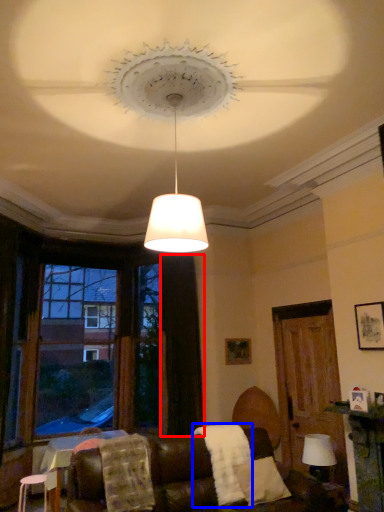
Question: Which of the following is the farthest to the observer, curtain (highlighted by a red box) or blanket (highlighted by a blue box)?

Choices:
 (A) curtain
 (B) blanket

Answer: (A)